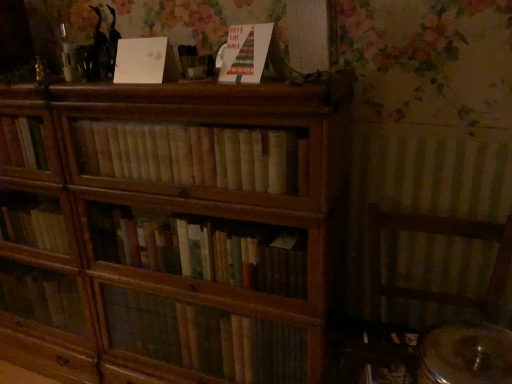
What do you see at coordinates (140, 60) in the screenshot? I see `white matte paper at upper center, the first paperback book when ordered from left to right` at bounding box center [140, 60].

What is the approximate height of white matte paper at upper center, the first paperback book when ordered from left to right?

It is 5.60 inches.

Identify the location of light brown wooden books at center. The height and width of the screenshot is (384, 512). (194, 155).

Which is behind, point (148, 76) or point (244, 154)?

The point (148, 76) is behind.

Consider the image. Is there a large distance between white matte paper at upper center, the first paperback book when ordered from left to right, and light brown wooden books at center?

That's not correct — white matte paper at upper center, the first paperback book when ordered from left to right, is a little close to light brown wooden books at center.

From a real-world perspective, is white matte paper at upper center, the 2th paperback book when ordered from right to left, physically located above or below light brown wooden books at center?

white matte paper at upper center, the 2th paperback book when ordered from right to left, is above light brown wooden books at center.

Consider the image. From the image's perspective, is white matte paper at upper center, the first paperback book when ordered from left to right, above light brown wooden books at center?

Yes, from the image's perspective, white matte paper at upper center, the first paperback book when ordered from left to right, is above light brown wooden books at center.

What's the angular difference between light brown wooden books at center and matte paper card at upper center, which is the 2th paperback book in left-to-right order,'s facing directions?

The angular difference between light brown wooden books at center and matte paper card at upper center, which is the 2th paperback book in left-to-right order, is 21.4 degrees.

Is light brown wooden books at center positioned behind matte paper card at upper center, the first paperback book from the right?

Yes.

From the image's perspective, is light brown wooden books at center under matte paper card at upper center, which is the 2th paperback book in left-to-right order?

Yes, from the image's perspective, light brown wooden books at center is below matte paper card at upper center, which is the 2th paperback book in left-to-right order.

Which object is positioned more to the left, light brown wooden books at center or matte paper card at upper center, the first paperback book from the right?

light brown wooden books at center.

Find the location of a particular element. paperback book to the left of matte paper card at upper center, which is the 2th paperback book in left-to-right order is located at coordinates (140, 60).

Is white matte paper at upper center, the first paperback book when ordered from left to right, shorter than matte paper card at upper center, which is the 2th paperback book in left-to-right order?

Yes.

From a real-world perspective, relative to matte paper card at upper center, the first paperback book from the right, is white matte paper at upper center, the 2th paperback book when ordered from right to left, vertically above or below?

From a real-world perspective, white matte paper at upper center, the 2th paperback book when ordered from right to left, is physically below matte paper card at upper center, the first paperback book from the right.

Which object is thinner, white matte paper at upper center, the 2th paperback book when ordered from right to left, or matte paper card at upper center, which is the 2th paperback book in left-to-right order?

white matte paper at upper center, the 2th paperback book when ordered from right to left, is thinner.

Is matte paper card at upper center, which is the 2th paperback book in left-to-right order, positioned far away from white matte paper at upper center, the first paperback book when ordered from left to right?

matte paper card at upper center, which is the 2th paperback book in left-to-right order, is actually quite close to white matte paper at upper center, the first paperback book when ordered from left to right.

Is matte paper card at upper center, which is the 2th paperback book in left-to-right order, oriented away from white matte paper at upper center, the first paperback book when ordered from left to right?

No.

Considering the positions of objects matte paper card at upper center, the first paperback book from the right, and white matte paper at upper center, the 2th paperback book when ordered from right to left, in the image provided, who is more to the right, matte paper card at upper center, the first paperback book from the right, or white matte paper at upper center, the 2th paperback book when ordered from right to left,?

From the viewer's perspective, matte paper card at upper center, the first paperback book from the right, appears more on the right side.

Which object is wider, light brown wooden books at center or white matte paper at upper center, the 2th paperback book when ordered from right to left?

light brown wooden books at center.

Which is farther, (83, 138) or (120, 76)?

The point (83, 138) is farther.

Can white matte paper at upper center, the 2th paperback book when ordered from right to left, be found inside light brown wooden books at center?

No, white matte paper at upper center, the 2th paperback book when ordered from right to left, is not surrounded by light brown wooden books at center.

Can you see light brown wooden books at center touching white matte paper at upper center, the 2th paperback book when ordered from right to left?

light brown wooden books at center is not next to white matte paper at upper center, the 2th paperback book when ordered from right to left, and they're not touching.

Identify the location of book behind the matte paper card at upper center, which is the 2th paperback book in left-to-right order. The image size is (512, 384). (194, 155).

Does matte paper card at upper center, which is the 2th paperback book in left-to-right order, touch light brown wooden books at center?

matte paper card at upper center, which is the 2th paperback book in left-to-right order, and light brown wooden books at center are clearly separated.

Can you confirm if matte paper card at upper center, which is the 2th paperback book in left-to-right order, is thinner than light brown wooden books at center?

Correct, the width of matte paper card at upper center, which is the 2th paperback book in left-to-right order, is less than that of light brown wooden books at center.

Where is `the 2nd paperback book above the light brown wooden books at center (from the image's perspective)`? Image resolution: width=512 pixels, height=384 pixels. the 2nd paperback book above the light brown wooden books at center (from the image's perspective) is located at coordinates (140, 60).

Image resolution: width=512 pixels, height=384 pixels. Find the location of `book behind the matte paper card at upper center, the first paperback book from the right`. book behind the matte paper card at upper center, the first paperback book from the right is located at coordinates (194, 155).

Based on the photo, looking at the image, which one is located further to white matte paper at upper center, the 2th paperback book when ordered from right to left, light brown wooden books at center or matte paper card at upper center, which is the 2th paperback book in left-to-right order?

light brown wooden books at center.

Looking at the image, which one is located further to white matte paper at upper center, the 2th paperback book when ordered from right to left, matte paper card at upper center, which is the 2th paperback book in left-to-right order, or light brown wooden books at center?

light brown wooden books at center is positioned further to the anchor white matte paper at upper center, the 2th paperback book when ordered from right to left.

Estimate the real-world distances between objects in this image. Which object is further from light brown wooden books at center, white matte paper at upper center, the first paperback book when ordered from left to right, or matte paper card at upper center, which is the 2th paperback book in left-to-right order?

matte paper card at upper center, which is the 2th paperback book in left-to-right order, is positioned further to the anchor light brown wooden books at center.

When comparing their distances from matte paper card at upper center, the first paperback book from the right, does light brown wooden books at center or white matte paper at upper center, the first paperback book when ordered from left to right, seem closer?

white matte paper at upper center, the first paperback book when ordered from left to right, is closer to matte paper card at upper center, the first paperback book from the right.

Considering their positions, is matte paper card at upper center, which is the 2th paperback book in left-to-right order, positioned closer to light brown wooden books at center than white matte paper at upper center, the 2th paperback book when ordered from right to left?

white matte paper at upper center, the 2th paperback book when ordered from right to left, is closer to light brown wooden books at center.

When comparing their distances from matte paper card at upper center, which is the 2th paperback book in left-to-right order, does white matte paper at upper center, the 2th paperback book when ordered from right to left, or light brown wooden books at center seem further?

light brown wooden books at center.

What are the coordinates of `book between white matte paper at upper center, the 2th paperback book when ordered from right to left, and matte paper card at upper center, the first paperback book from the right, from left to right` in the screenshot? It's located at (194, 155).